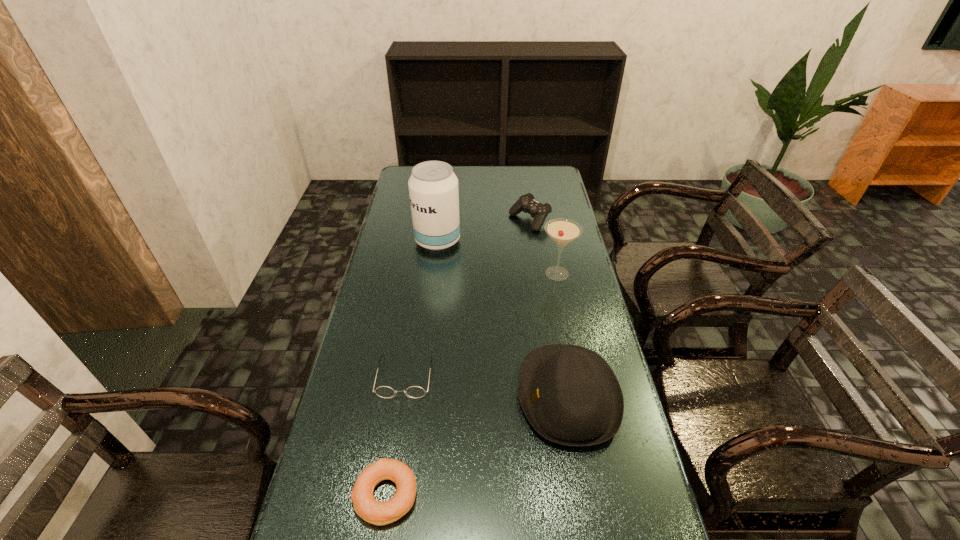
The image size is (960, 540). Identify the location of vacant space located 0.390m on the front-facing side of the third tallest object. (372, 396).

Image resolution: width=960 pixels, height=540 pixels. In order to click on vacant space situated 0.260m on the front-facing side of the third tallest object in this screenshot , I will do `click(420, 396)`.

This screenshot has width=960, height=540. I want to click on vacant space located on the back of the control, so click(x=522, y=173).

Locate an element on the screen. This screenshot has width=960, height=540. free location located 0.180m on the front-facing side of the spectacles is located at coordinates (391, 465).

Locate an element on the screen. free space located on the right of the nearest object is located at coordinates (573, 495).

Locate an element on the screen. Image resolution: width=960 pixels, height=540 pixels. alcohol at the left edge is located at coordinates tap(433, 187).

Locate an element on the screen. spectacles that is at the left edge is located at coordinates (383, 391).

Identify the location of bagel at the left edge. Image resolution: width=960 pixels, height=540 pixels. (365, 505).

Where is `martini that is at the right edge`? The width and height of the screenshot is (960, 540). martini that is at the right edge is located at coordinates (562, 231).

Locate an element on the screen. The image size is (960, 540). fedora that is at the right edge is located at coordinates (570, 395).